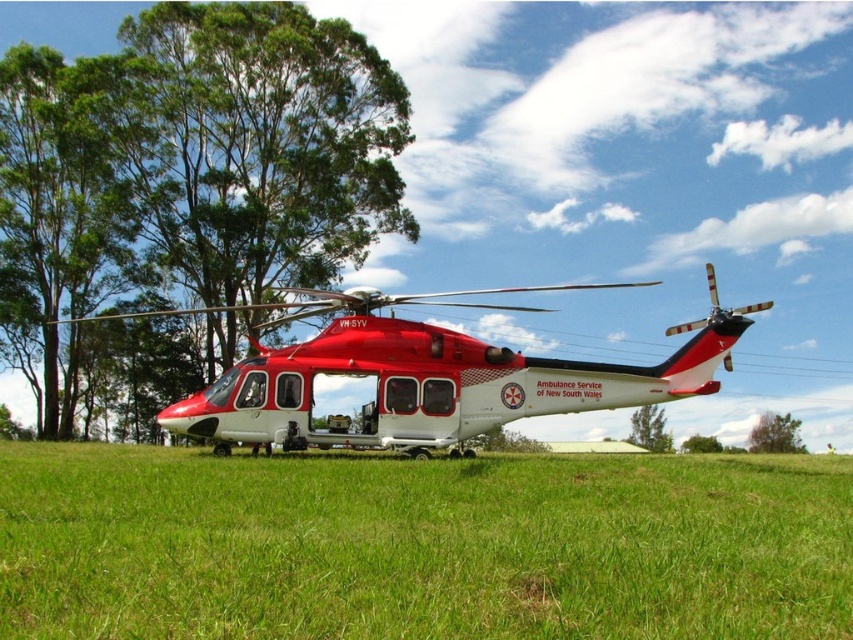
Question: Does green leafy tree at upper left have a lesser width compared to green leafy tree at lower center?

Choices:
 (A) no
 (B) yes

Answer: (A)

Question: From the image, what is the correct spatial relationship of matte red helicopter at center in relation to green leafy tree at center?

Choices:
 (A) above
 (B) below

Answer: (A)

Question: Can you confirm if green grass at center is positioned above green leafy tree at upper left?

Choices:
 (A) yes
 (B) no

Answer: (B)

Question: Which is farther from the matte red helicopter at center?

Choices:
 (A) green leafy tree at upper left
 (B) green grass at center

Answer: (B)

Question: Which is farther from the green leafy tree at center?

Choices:
 (A) green leafy tree at upper left
 (B) green leafy tree at lower center

Answer: (A)

Question: Estimate the real-world distances between objects in this image. Which object is farther from the green leafy tree at upper left?

Choices:
 (A) matte red helicopter at center
 (B) green leafy tree at center

Answer: (B)